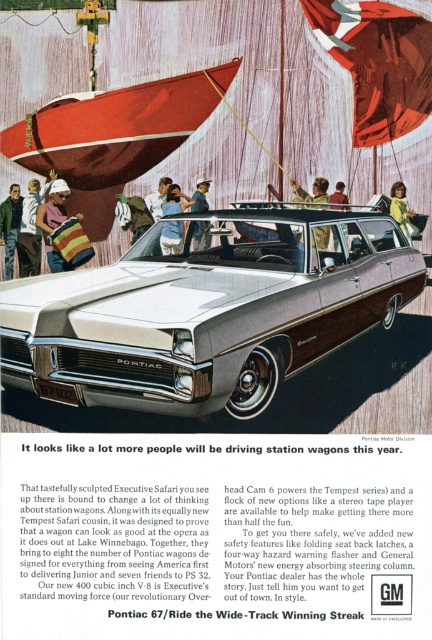
You are looking at the vintage advertisement for the Pontiac Executive Safari station wagon. In the image, there are a striped sweater at center and a denim jacket at center. Which one is located to the left of the other?

The striped sweater at center is positioned on the left side of denim jacket at center.